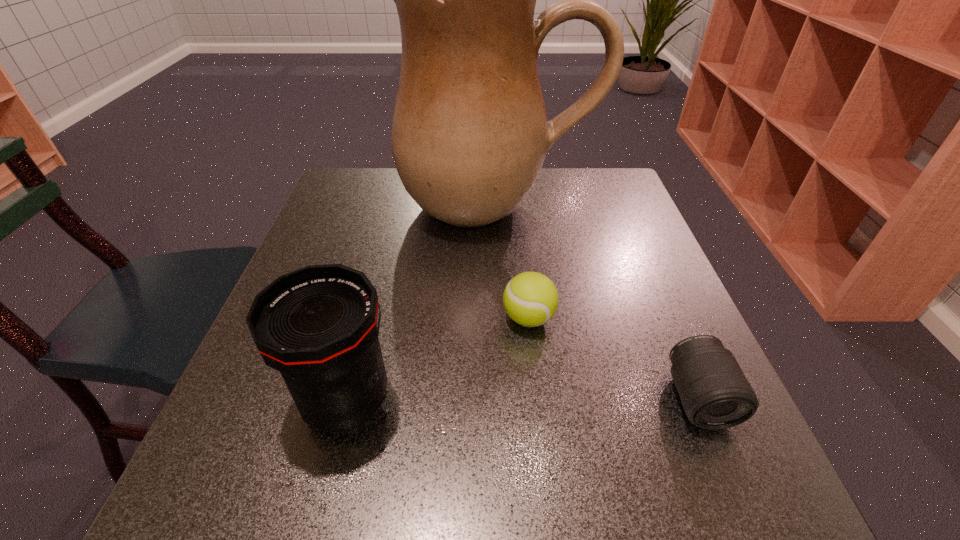
At what (x,y) coordinates should I click in order to perform the action: click on object that is at the far edge. Please return your answer as a coordinate pair (x, y). Looking at the image, I should click on (x=470, y=134).

Identify the location of object located at the left edge. (318, 326).

At what (x,y) coordinates should I click in order to perform the action: click on cream pitcher located in the right edge section of the desktop. Please return your answer as a coordinate pair (x, y). Looking at the image, I should click on (470, 134).

This screenshot has height=540, width=960. I want to click on telephoto lens at the right edge, so click(x=715, y=394).

Locate an element on the screen. object located in the far right corner section of the desktop is located at coordinates (470, 134).

Find the location of a particular element. The height and width of the screenshot is (540, 960). vacant space at the far edge of the desktop is located at coordinates (394, 203).

Locate an element on the screen. This screenshot has height=540, width=960. vacant point at the near edge is located at coordinates (582, 485).

At what (x,y) coordinates should I click in order to perform the action: click on free space at the left edge. Please return your answer as a coordinate pair (x, y). The height and width of the screenshot is (540, 960). Looking at the image, I should click on (342, 253).

The width and height of the screenshot is (960, 540). What are the coordinates of `vacant space at the right edge` in the screenshot? It's located at (648, 407).

Locate an element on the screen. free space at the far right corner is located at coordinates (616, 202).